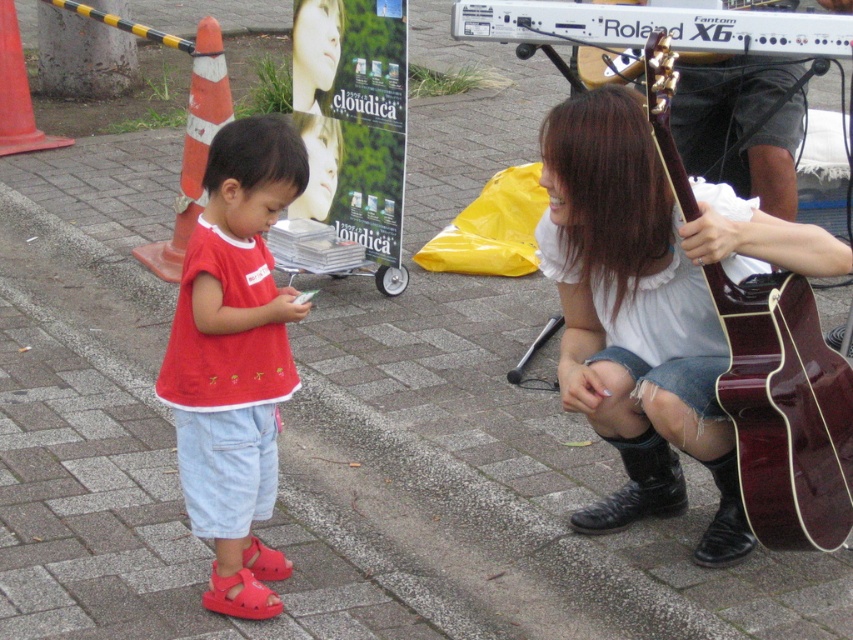
Is point (718, 273) positioned before point (318, 3)?

Yes, point (718, 273) is closer to viewer.

Between shiny dark wood guitar at lower right and smooth skin face at upper center, which one has less height?

Standing shorter between the two is smooth skin face at upper center.

Is point (755, 384) closer to camera compared to point (331, 52)?

Yes, point (755, 384) is closer to viewer.

At what (x,y) coordinates should I click in order to perform the action: click on shiny dark wood guitar at lower right. Please return your answer as a coordinate pair (x, y). The image size is (853, 640). Looking at the image, I should click on (785, 410).

Does matte red sandals at lower left appear on the right side of shiny dark wood guitar at lower right?

No, matte red sandals at lower left is not to the right of shiny dark wood guitar at lower right.

Who is lower down, matte red sandals at lower left or shiny dark wood guitar at lower right?

matte red sandals at lower left is below.

The image size is (853, 640). What do you see at coordinates (235, 356) in the screenshot?
I see `matte red sandals at lower left` at bounding box center [235, 356].

In order to click on matte red sandals at lower left in this screenshot , I will do `click(235, 356)`.

What do you see at coordinates (235, 356) in the screenshot? I see `matte red sandals at lower left` at bounding box center [235, 356].

Can you confirm if matte red sandals at lower left is bigger than smooth skin face at upper center?

Correct, matte red sandals at lower left is larger in size than smooth skin face at upper center.

This screenshot has height=640, width=853. Describe the element at coordinates (235, 356) in the screenshot. I see `matte red sandals at lower left` at that location.

This screenshot has width=853, height=640. I want to click on matte red sandals at lower left, so click(x=235, y=356).